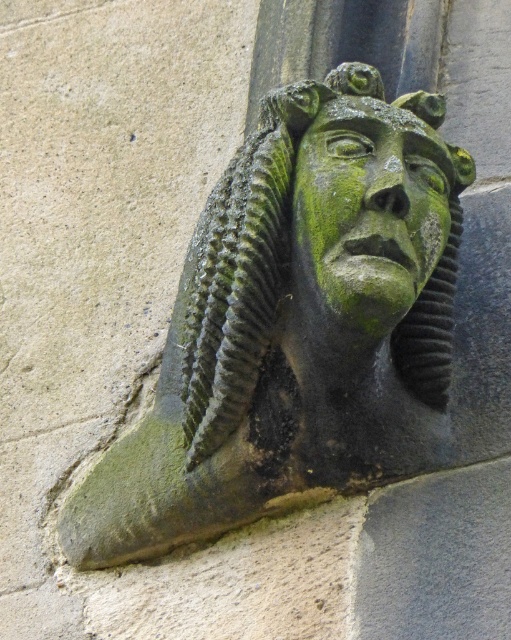
You are an architect examining the stone gargoyle. You notice the green stone head at center and the green stone face at center. Which one is located below the other?

The green stone head at center is positioned under the green stone face at center, so the head is below the face.

You are an architect examining the stone gargoyle. You notice two features labeled as the green stone head at center and the green stone face at center. Which one is closer to you?

The green stone head at center is closer to you because it is in front of the green stone face at center.

You are an architect designing a new building and want to place a green stone head at center in the exact same position as the one in the image. What coordinates should you use?

The green stone head at center is located at point [290,317], so you should place it at those coordinates.